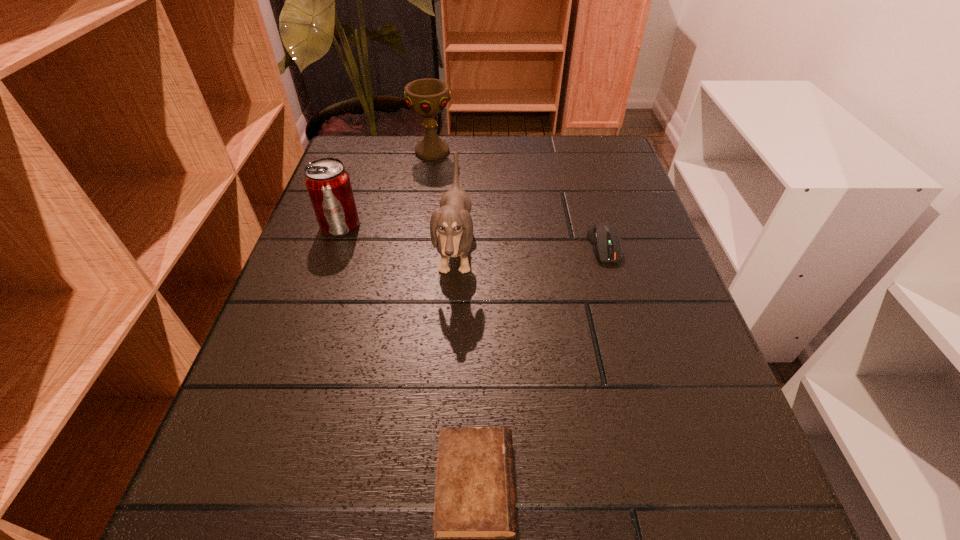
Locate an element on the screen. The image size is (960, 540). free space located 0.270m on the spine side of the diary is located at coordinates (723, 485).

The height and width of the screenshot is (540, 960). In order to click on object that is at the far edge in this screenshot , I will do `click(427, 97)`.

You are a GUI agent. You are given a task and a screenshot of the screen. Output one action in this format:
    pyautogui.click(x=<x>, y=<y>)
    Task: Click on the object located at the near edge
    This screenshot has width=960, height=540.
    Given the screenshot: What is the action you would take?
    pyautogui.click(x=474, y=498)

Where is `object that is at the left edge`? Image resolution: width=960 pixels, height=540 pixels. object that is at the left edge is located at coordinates pos(328,183).

The width and height of the screenshot is (960, 540). Identify the location of object at the right edge. [604, 238].

Image resolution: width=960 pixels, height=540 pixels. What are the coordinates of `blank area at the far edge` in the screenshot? It's located at 414,174.

Locate an element on the screen. The image size is (960, 540). free space at the near edge is located at coordinates (422, 534).

In the image, there is a desktop. Identify the location of free space at the left edge. The width and height of the screenshot is (960, 540). (340, 348).

Where is `free space at the right edge`? The image size is (960, 540). free space at the right edge is located at coordinates (648, 367).

This screenshot has width=960, height=540. Find the location of `vacant point at the near left corner`. vacant point at the near left corner is located at coordinates pyautogui.click(x=230, y=519).